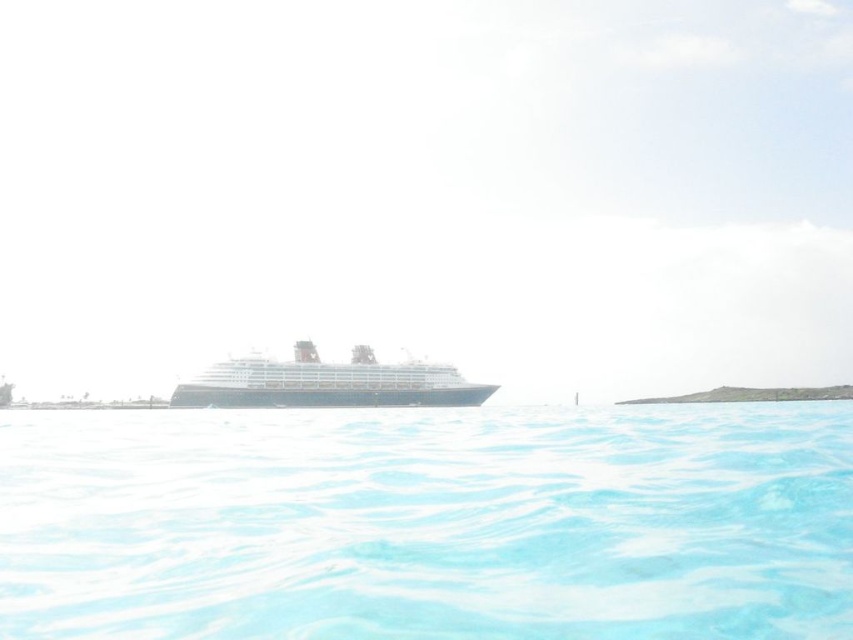
Question: Is clear blue water at lower center positioned behind black glossy cruise ship at center?

Choices:
 (A) yes
 (B) no

Answer: (B)

Question: Does clear blue water at lower center come behind black glossy cruise ship at center?

Choices:
 (A) no
 (B) yes

Answer: (A)

Question: Where is clear blue water at lower center located in relation to black glossy cruise ship at center in the image?

Choices:
 (A) left
 (B) right

Answer: (B)

Question: Which point is closer to the camera?

Choices:
 (A) (466, 397)
 (B) (693, 582)

Answer: (B)